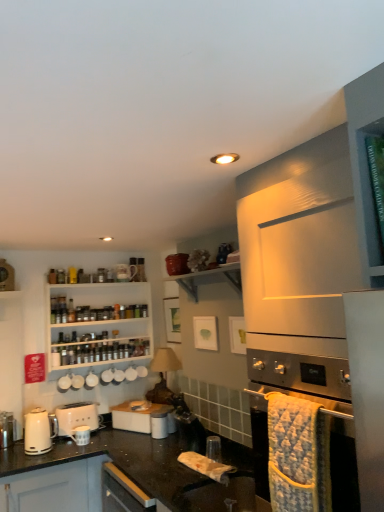
Find the location of a particular element. This screenshot has height=512, width=384. unoccupied region to the right of white glossy electric kettle at lower left, placed as the 1th kitchen appliance when sorted from front to back is located at coordinates (78, 451).